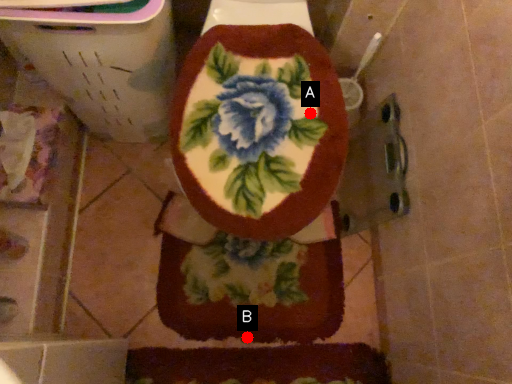
Question: Two points are circled on the image, labeled by A and B beside each circle. Which of the following is the closest to the observer?

Choices:
 (A) A is closer
 (B) B is closer

Answer: (A)